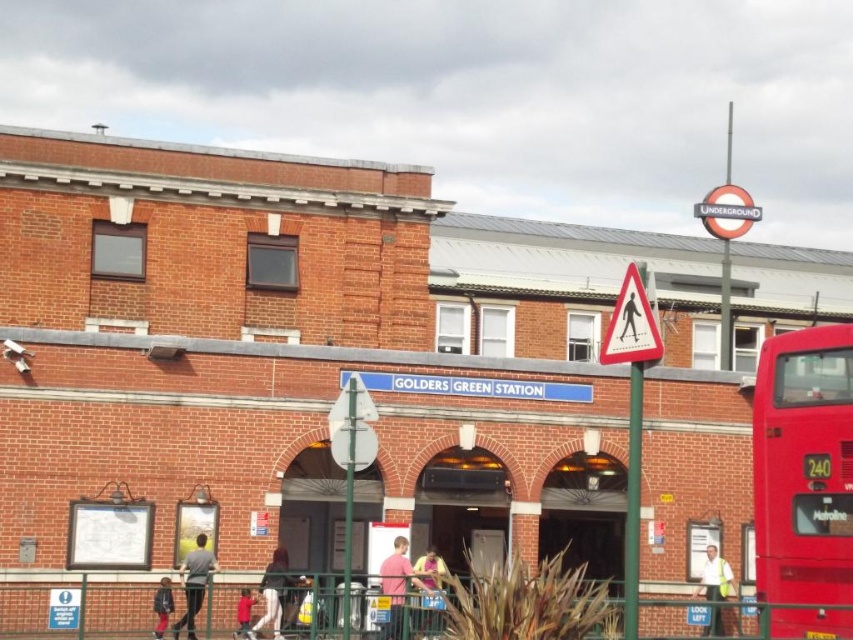
You are standing in front of Golders Green Station and want to take a photo that includes both the station entrance and the red double decker bus. The entrance is at point (399, 572) and the bus is at point (245, 600). Which point should you focus on first to ensure both are in frame?

Point (399, 572) is closer to the viewer than point (245, 600), so you should focus on point (399, 572) first to ensure both the station entrance and the bus are in frame.

You are a photographer trying to capture the Golders Green Station sign and the pink matte shirt at center in the same frame. Given that the sign is at the top of the station building and the shirt is at the specified coordinates, can you position yourself so both are visible without moving either object?

The pink matte shirt at center is located at point (x=397, y=586), which is within the frame. Since the sign is at the top of the station building and the shirt is centrally positioned, you can position yourself in front of the station where both the top of the building and the central area are visible, thus capturing both in the same frame.